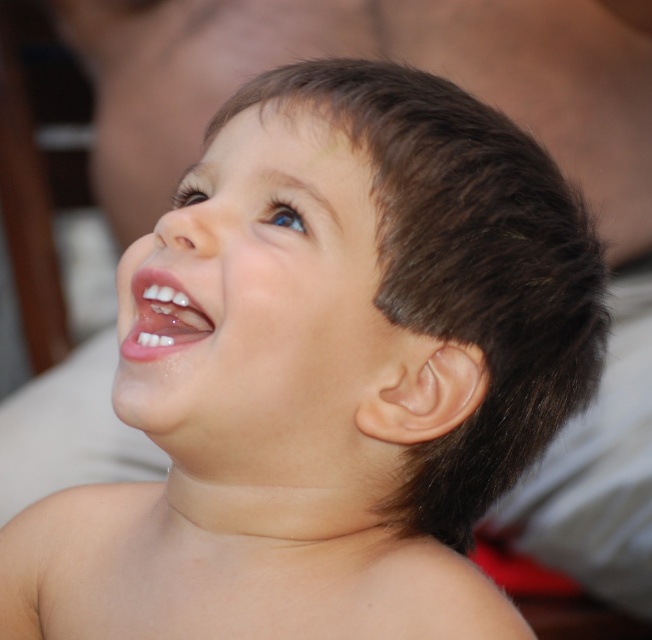
Based on the scene description, which object is positioned higher on the child? The smooth skin face at center or the white glossy teeth at center?

The smooth skin face at center is positioned higher than the white glossy teeth at center.

Looking at this image, you are a photographer trying to capture a closeup of a child. You need to ensure that the smooth skin face at center and the white glossy teeth at center are clearly visible. Given that your camera has a minimum focus distance of 2 inches, will you be able to focus on both features without moving the camera closer?

The smooth skin face at center and white glossy teeth at center are 1.99 inches apart from each other. Since the distance between them is less than the camera minimum focus distance of 2 inches, the camera can focus on both features without moving closer.